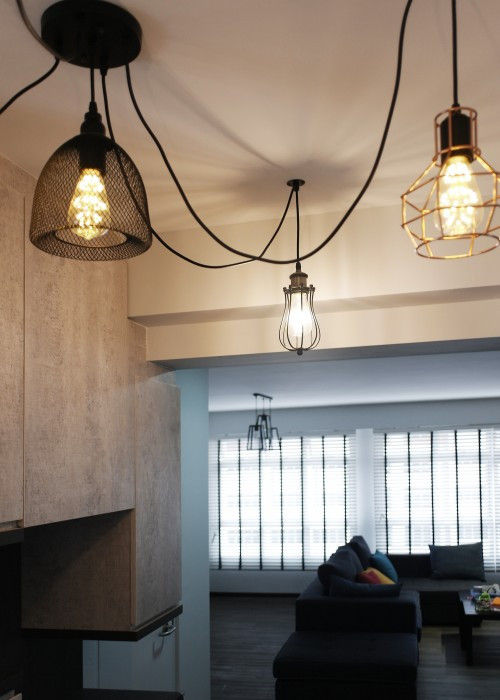
Where is `white ceiling`? The width and height of the screenshot is (500, 700). white ceiling is located at coordinates (253, 41).